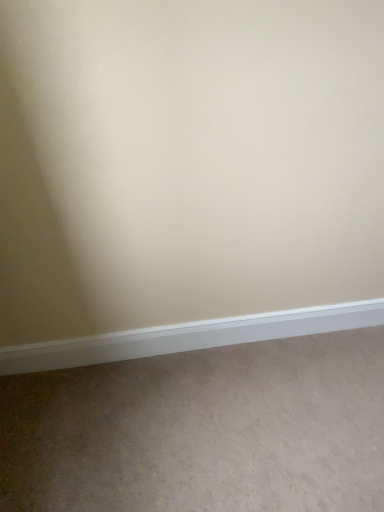
Locate an element on the screen. blank space above white smooth baseboard at lower center (from a real-world perspective) is located at coordinates (209, 319).